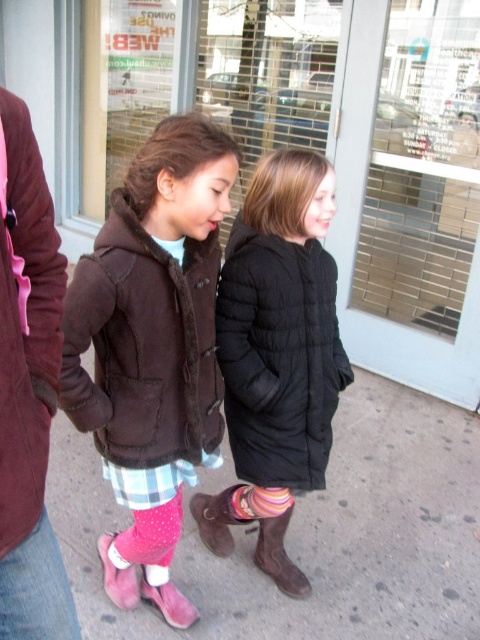
Which is above, pink suede boots at lower center or brown suede boot at lower center?

pink suede boots at lower center is higher up.

Does pink suede boots at lower center have a lesser height compared to brown suede boot at lower center?

Incorrect, pink suede boots at lower center's height does not fall short of brown suede boot at lower center's.

Between point (453, 445) and point (268, 563), which one is positioned in front?

Point (268, 563)

Locate an element on the screen. The height and width of the screenshot is (640, 480). pink suede boots at lower center is located at coordinates (312, 534).

Is pink suede boots at lower center shorter than brown fuzzy jacket at center?

Yes, pink suede boots at lower center is shorter than brown fuzzy jacket at center.

Is pink suede boots at lower center thinner than brown fuzzy jacket at center?

No, pink suede boots at lower center is not thinner than brown fuzzy jacket at center.

Locate an element on the screen. pink suede boots at lower center is located at coordinates (312, 534).

Can you confirm if brown fuzzy jacket at center is positioned to the right of pink striped sock at lower center?

No, brown fuzzy jacket at center is not to the right of pink striped sock at lower center.

Is brown fuzzy jacket at center closer to the viewer compared to pink striped sock at lower center?

Yes, brown fuzzy jacket at center is in front of pink striped sock at lower center.

Is point (76, 356) positioned behind point (163, 572)?

No.

At what (x,y) coordinates should I click in order to perform the action: click on brown fuzzy jacket at center. Please return your answer as a coordinate pair (x, y). Looking at the image, I should click on (144, 346).